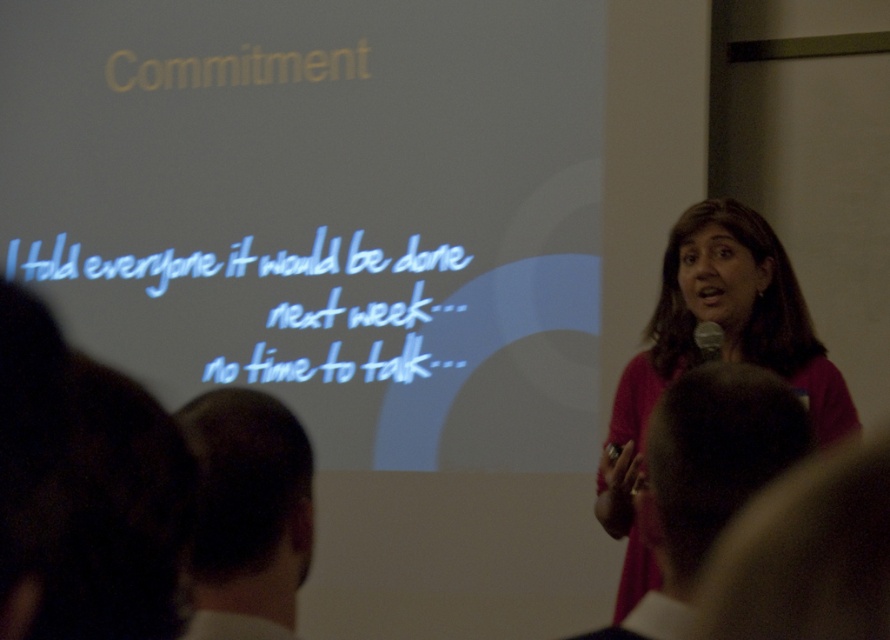
Question: Does white matte projection screen at upper center have a lesser width compared to dark brown hair at lower left?

Choices:
 (A) yes
 (B) no

Answer: (B)

Question: Among these points, which one is farthest from the camera?

Choices:
 (A) (257, 433)
 (B) (700, 330)
 (C) (709, 244)

Answer: (C)

Question: Which is nearer to the matte pink shirt at right?

Choices:
 (A) dark brown hair at lower left
 (B) white handwritten text at center

Answer: (B)

Question: Does white handwritten text at center come behind metallic silver microphone at upper right?

Choices:
 (A) yes
 (B) no

Answer: (A)

Question: Is the position of white matte projection screen at upper center more distant than that of matte pink shirt at right?

Choices:
 (A) no
 (B) yes

Answer: (B)

Question: Among these points, which one is farthest from the camera?

Choices:
 (A) (662, 448)
 (B) (611, 458)
 (C) (151, 294)

Answer: (C)